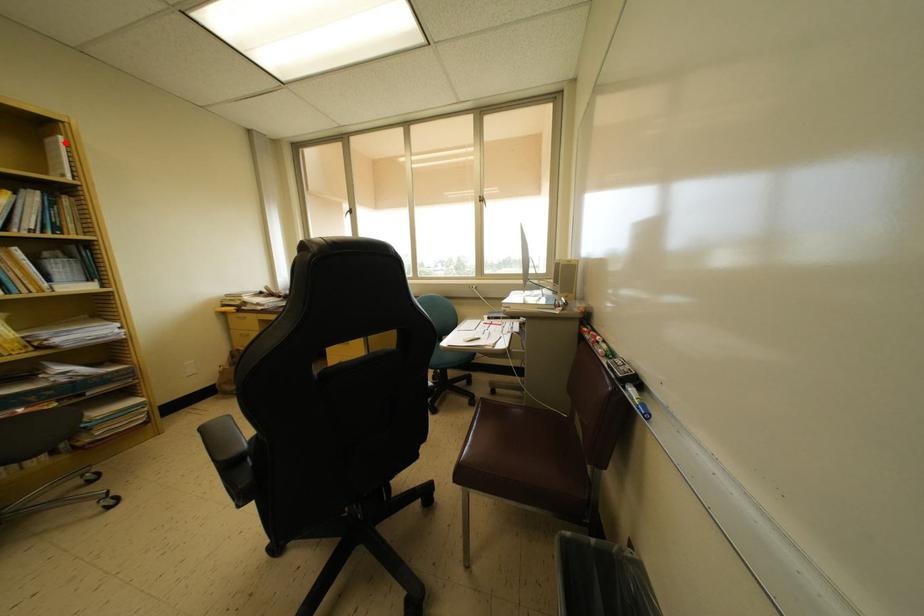
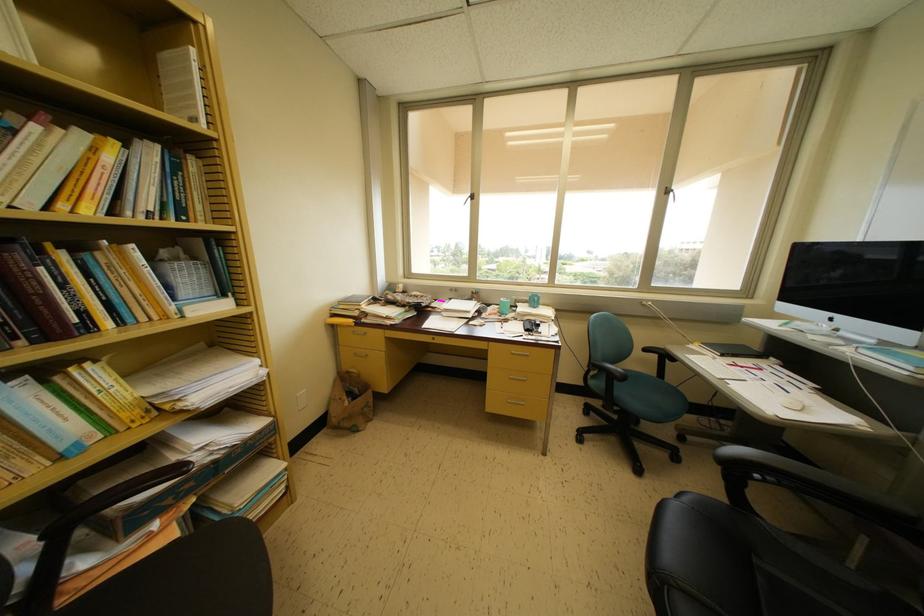
Locate, in the second image, the point that corresponds to the highlighted location in the first image.

(197, 55)